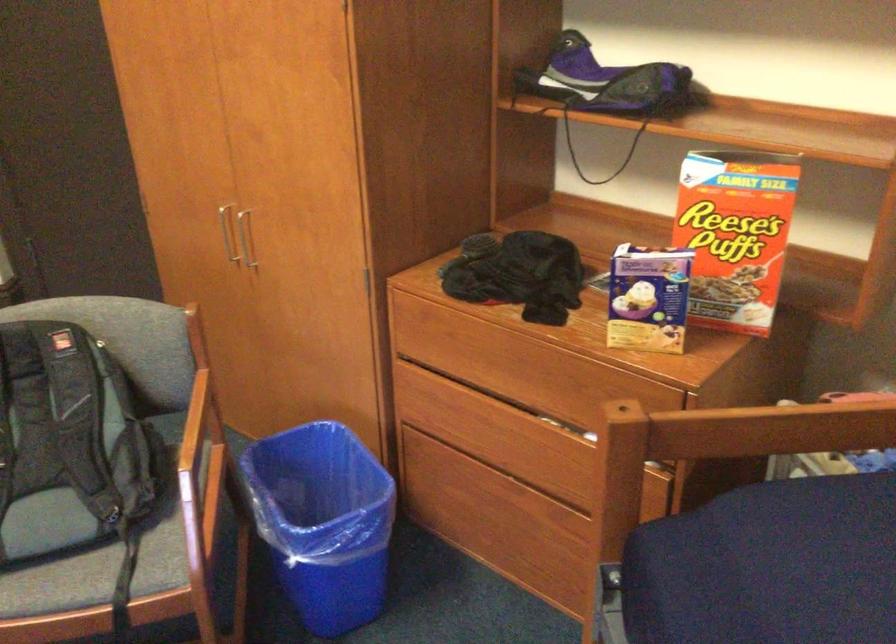
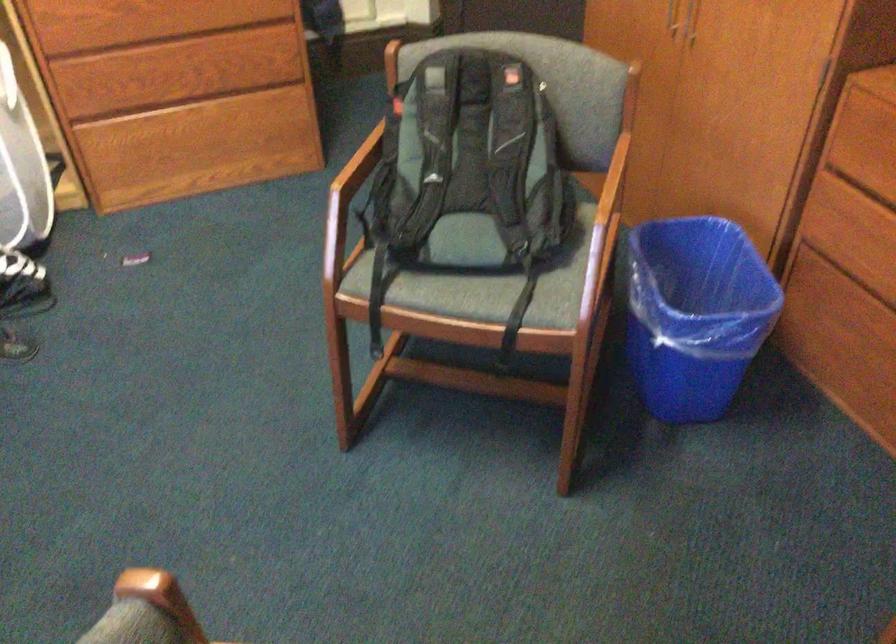
Question: I am providing you with two images of the same scene from different viewpoints. Which of the following objects are not visible in image2?

Choices:
 (A) drawer handle
 (B) cabinet door handle
 (C) blue trash can
 (D) none of these

Answer: (D)